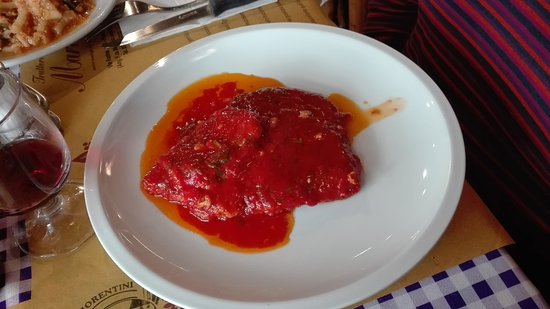
Identify the location of wineglass. This screenshot has height=309, width=550. (30, 186), (56, 232).